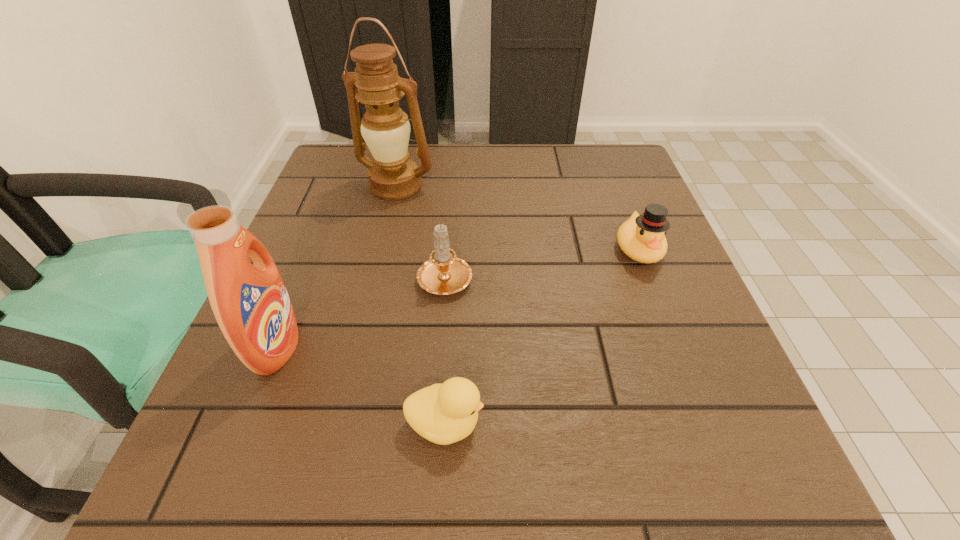
In order to click on vacant area that satisfies the following two spatial constraints: 1. on the front-facing side of the rightmost object; 2. on the front-facing side of the second nearest object in this screenshot , I will do `click(676, 347)`.

Image resolution: width=960 pixels, height=540 pixels. In order to click on vacant space that satisfies the following two spatial constraints: 1. on the front-facing side of the right duck; 2. on the front-facing side of the nearest object in this screenshot , I will do `click(705, 424)`.

Where is `free point that satisfies the following two spatial constraints: 1. on the front-facing side of the rightmost object; 2. on the front-facing side of the shortest object`? This screenshot has height=540, width=960. free point that satisfies the following two spatial constraints: 1. on the front-facing side of the rightmost object; 2. on the front-facing side of the shortest object is located at coordinates (705, 424).